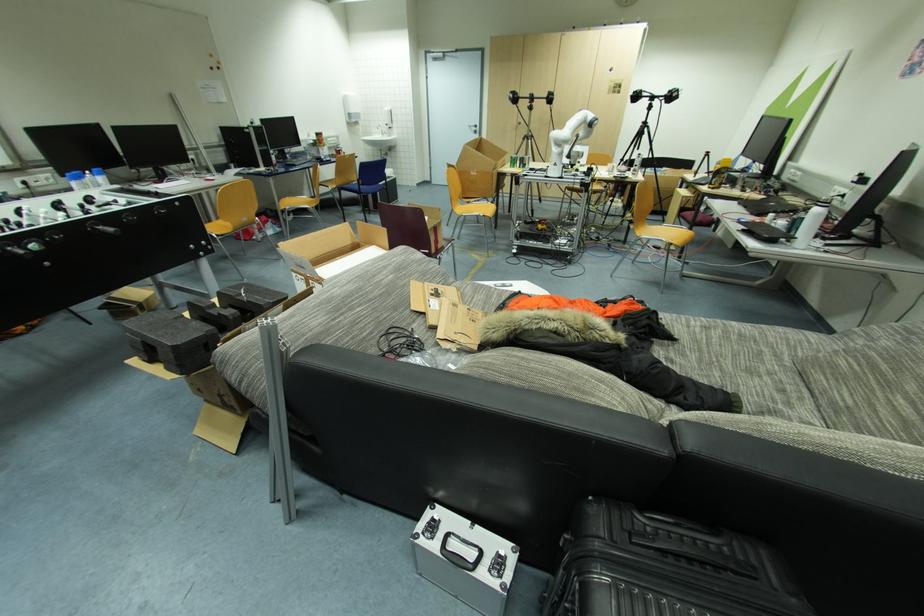
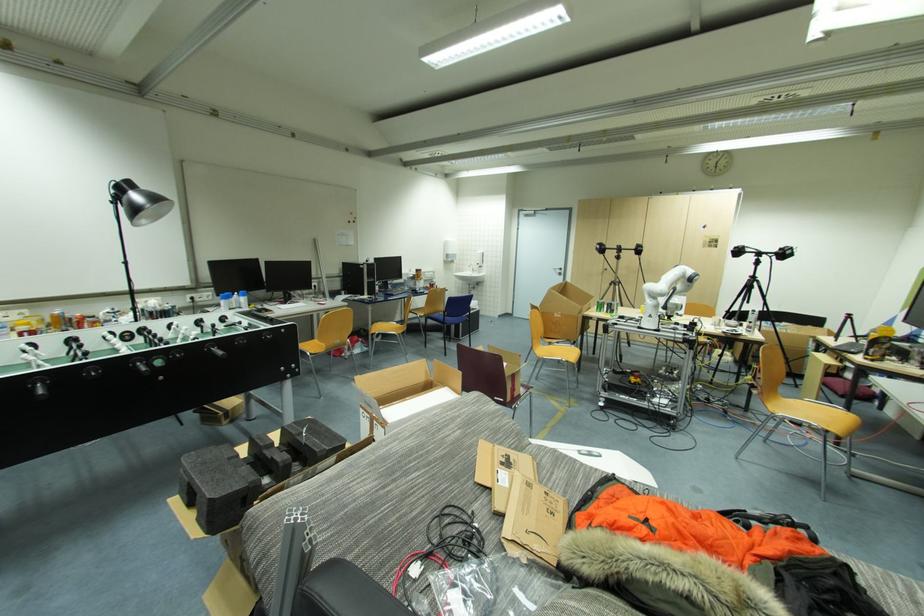
Locate, in the second image, the point that corresponds to point (487, 217) in the first image.

(570, 362)